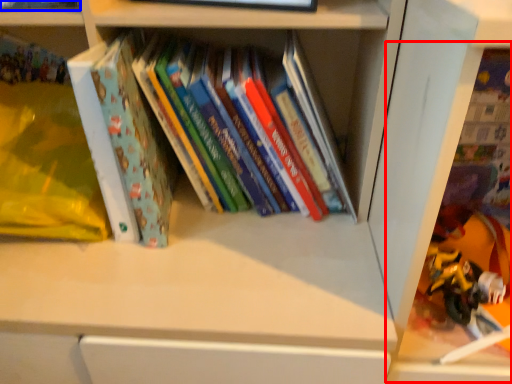
Question: Among these objects, which one is nearest to the camera, shelf (highlighted by a red box) or book (highlighted by a blue box)?

Choices:
 (A) shelf
 (B) book

Answer: (A)